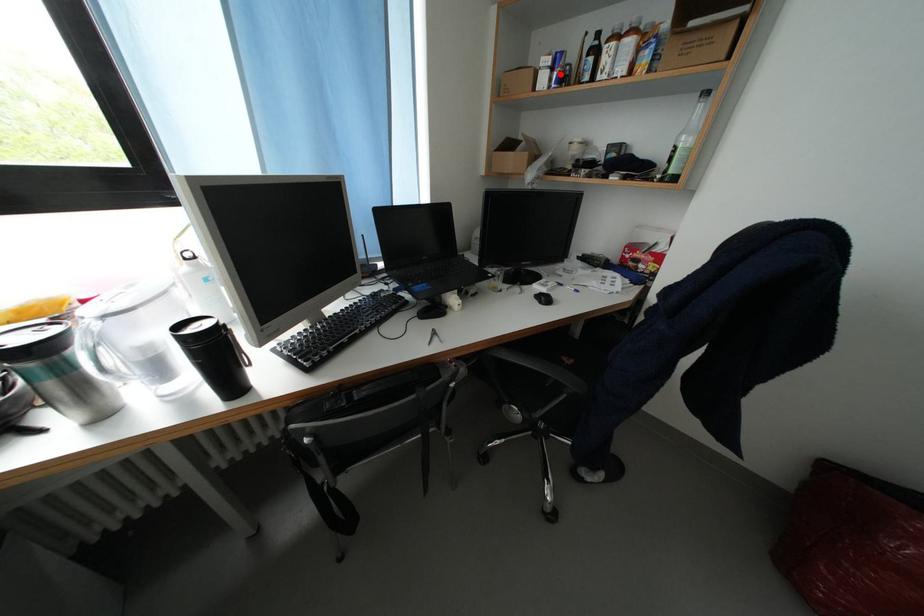
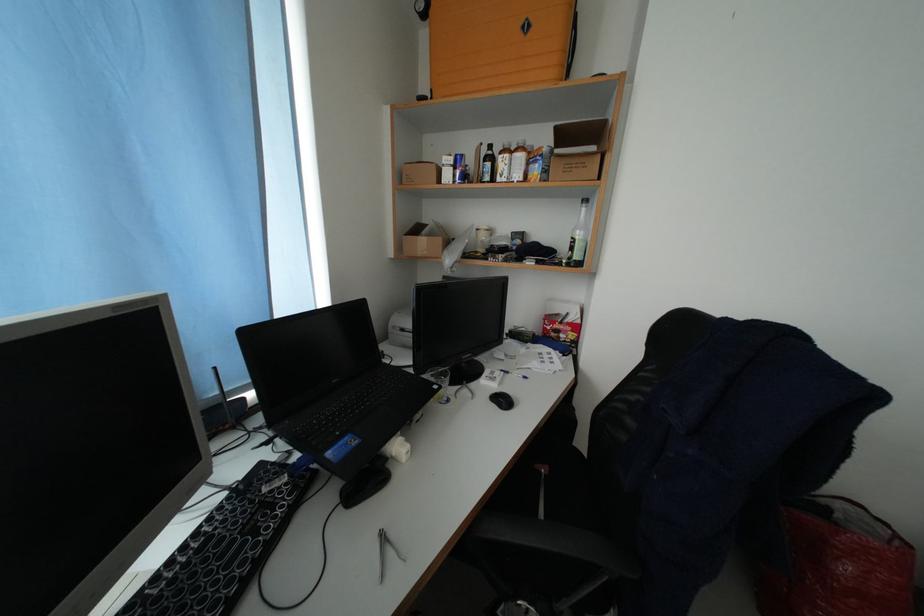
The point at the highlighted location is marked in the first image. Where is the corresponding point in the second image?

(464, 172)